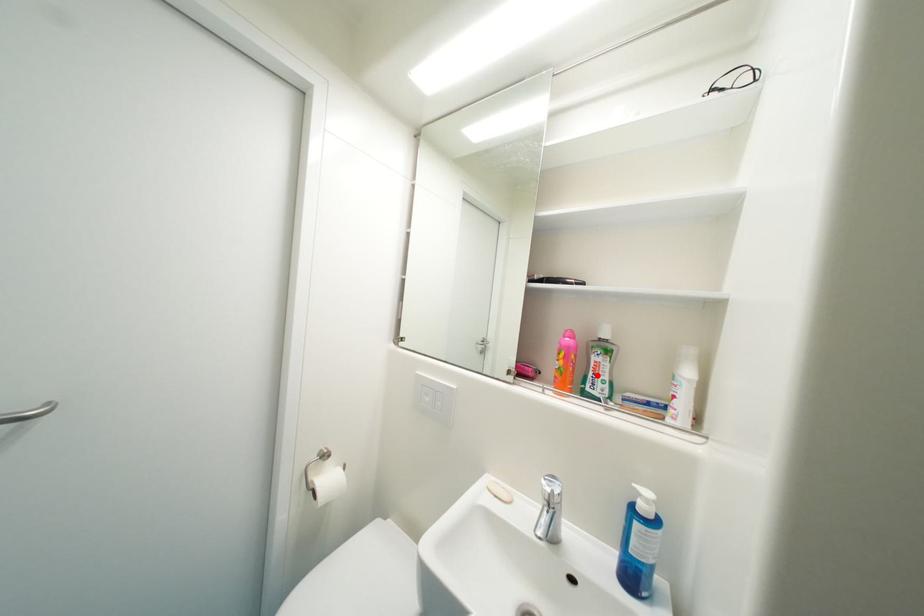
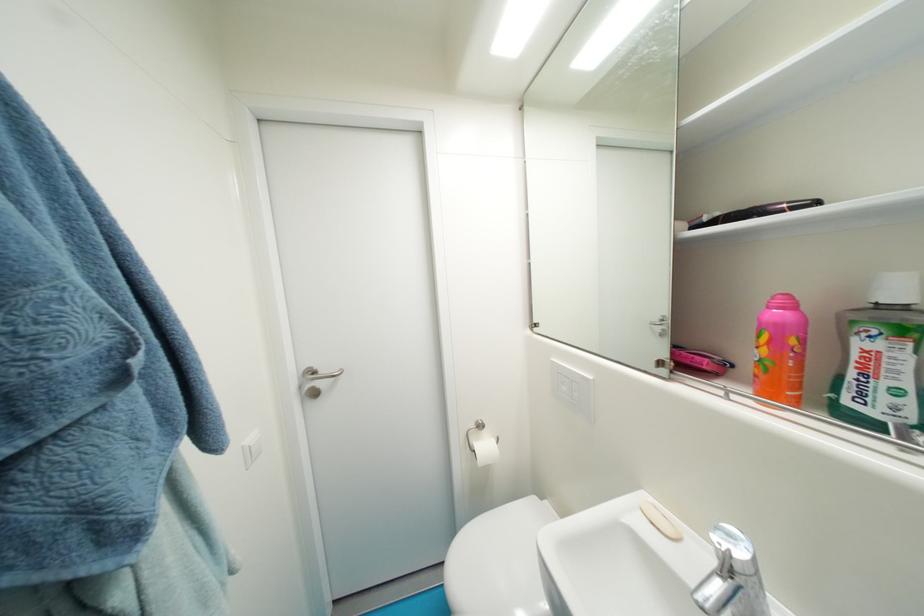
Where in the second image is the point corresponding to the highlighted location from the first image?

(858, 376)